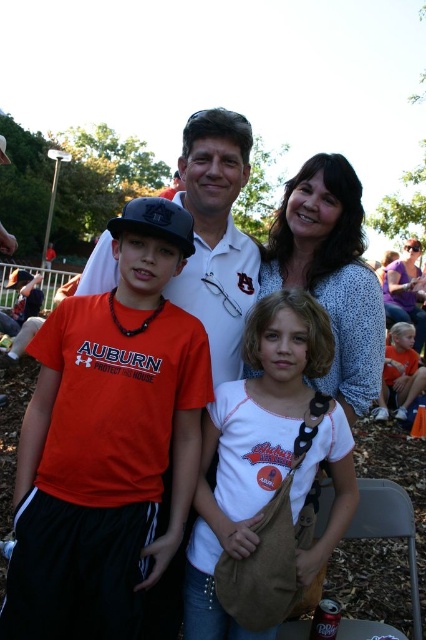
In the scene shown: Who is lower down, white dotted blouse at center or white matte shirt at center?

Positioned lower is white dotted blouse at center.

Is white dotted blouse at center to the left of white matte shirt at center from the viewer's perspective?

No, white dotted blouse at center is not to the left of white matte shirt at center.

Who is more distant from viewer, (282, 241) or (236, 164)?

Point (282, 241)

Locate an element on the screen. white dotted blouse at center is located at coordinates (331, 273).

Is the position of white matte shirt at center more distant than that of matte purple shirt at upper right?

No, it is not.

Between white matte shirt at center and matte purple shirt at upper right, which one appears on the left side from the viewer's perspective?

From the viewer's perspective, white matte shirt at center appears more on the left side.

What are the coordinates of `white matte shirt at center` in the screenshot? It's located at (216, 234).

What are the coordinates of `white matte shirt at center` in the screenshot? It's located at (216, 234).

From the picture: Is orange cotton shirt at center smaller than white dotted blouse at center?

Yes.

You are a GUI agent. You are given a task and a screenshot of the screen. Output one action in this format:
    pyautogui.click(x=<x>, y=<y>)
    Task: Click on the orange cotton shirt at center
    The height and width of the screenshot is (640, 426).
    Given the screenshot: What is the action you would take?
    pyautogui.click(x=108, y=442)

You are a GUI agent. You are given a task and a screenshot of the screen. Output one action in this format:
    pyautogui.click(x=<x>, y=<y>)
    Task: Click on the orange cotton shirt at center
    This screenshot has width=426, height=640.
    Given the screenshot: What is the action you would take?
    pyautogui.click(x=108, y=442)